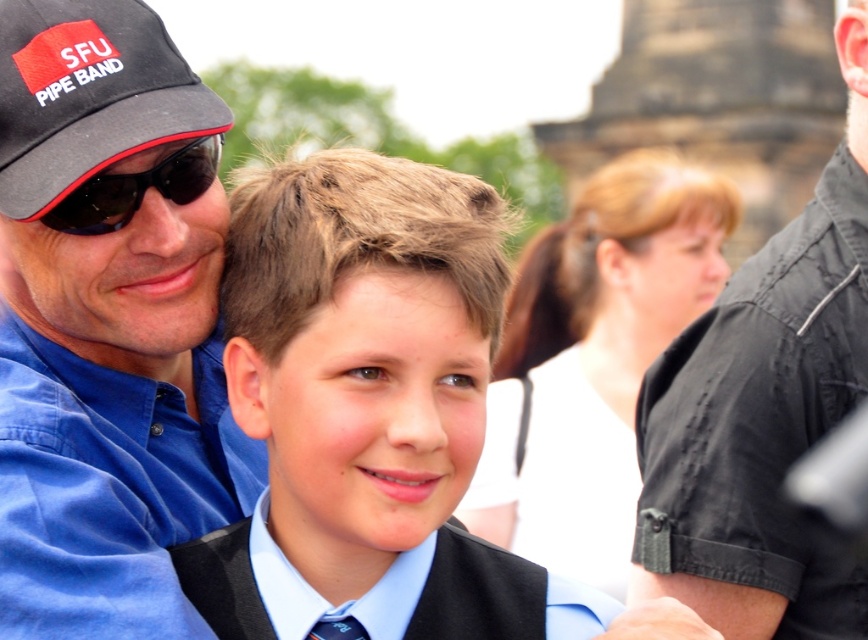
Question: Can you confirm if black matte shirt at upper right is positioned to the left of blue silk tie at lower center?

Choices:
 (A) no
 (B) yes

Answer: (A)

Question: Can you confirm if black fabric baseball cap at upper left is positioned below black plastic sunglasses at left?

Choices:
 (A) yes
 (B) no

Answer: (B)

Question: Is black matte shirt at upper right bigger than black fabric baseball cap at upper left?

Choices:
 (A) no
 (B) yes

Answer: (B)

Question: Which object is closer to the camera taking this photo?

Choices:
 (A) black plastic sunglasses at left
 (B) blue fabric shirt at left
 (C) black fabric baseball cap at upper left

Answer: (B)

Question: Which point is farther to the camera?

Choices:
 (A) black fabric baseball cap at upper left
 (B) black plastic sunglasses at left

Answer: (B)

Question: Which object is closer to the camera taking this photo?

Choices:
 (A) blue fabric shirt at left
 (B) light blue fabric shirt at center
 (C) black fabric baseball cap at upper left

Answer: (A)